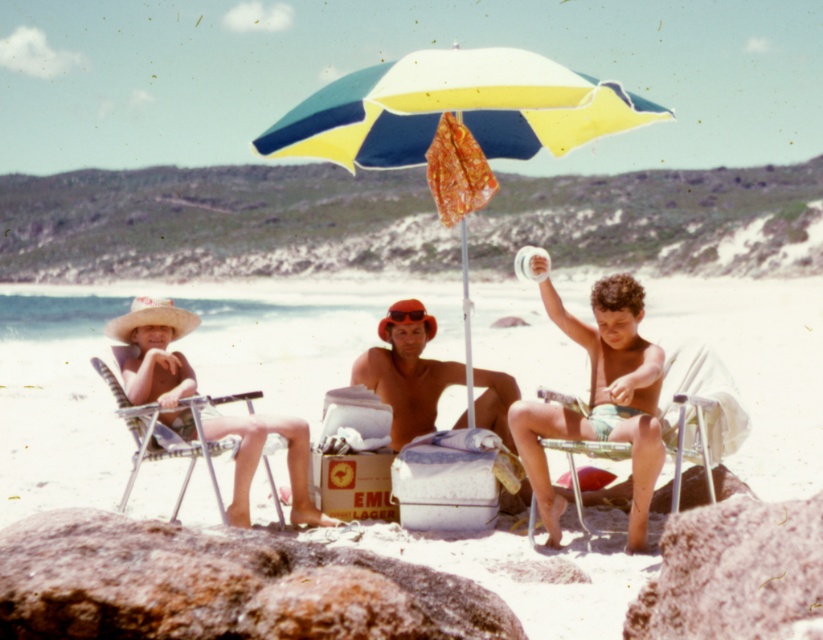
Between matte green shorts at center and metallic silver beach chair at left, which one appears on the left side from the viewer's perspective?

Positioned to the left is metallic silver beach chair at left.

Is matte green shorts at center smaller than metallic silver beach chair at left?

Yes.

Find the location of a particular element. matte green shorts at center is located at coordinates (598, 397).

I want to click on matte green shorts at center, so click(598, 397).

Between white sand beach at center and brown leather hat at center, which one appears on the left side from the viewer's perspective?

white sand beach at center

Between point (802, 432) and point (412, 401), which one is positioned in front?

Point (412, 401) is in front.

Where is `white sand beach at center`? This screenshot has height=640, width=823. white sand beach at center is located at coordinates click(x=186, y=356).

Between white sand beach at center and yellow and blue fabric umbrella at center, which one has more height?

white sand beach at center

Is white sand beach at center below yellow and blue fabric umbrella at center?

Yes.

Is point (807, 417) positioned in front of point (532, 148)?

That is False.

The image size is (823, 640). Find the location of `white sand beach at center`. white sand beach at center is located at coordinates (186, 356).